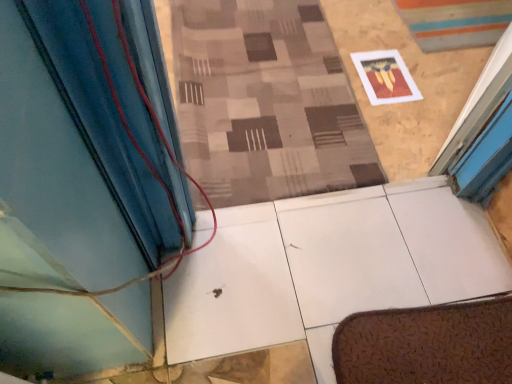
This screenshot has height=384, width=512. What do you see at coordinates (385, 77) in the screenshot?
I see `matte white picture frame at upper right` at bounding box center [385, 77].

In order to face matte white picture frame at upper right, should I rotate leftwards or rightwards?

You should look right and rotate roughly 16.894 degrees.

Locate an element on the screen. matte white picture frame at upper right is located at coordinates [385, 77].

This screenshot has width=512, height=384. In order to click on matte white picture frame at upper right in this screenshot , I will do `click(385, 77)`.